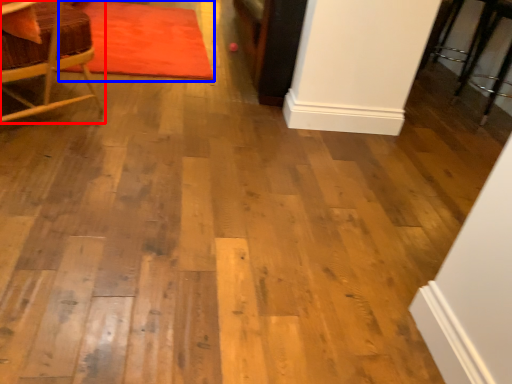
Question: Among these objects, which one is nearest to the camera, chair (highlighted by a red box) or mat (highlighted by a blue box)?

Choices:
 (A) chair
 (B) mat

Answer: (A)